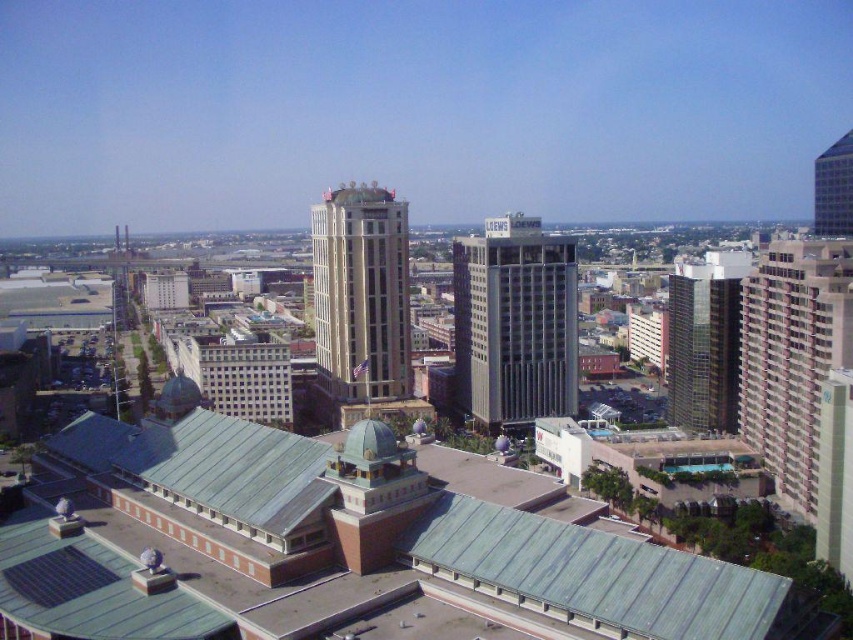
Is gray/concrete skyscraper at center thinner than glassy reflective skyscraper at upper right?

Yes.

Between gray/concrete skyscraper at center and glassy reflective skyscraper at upper right, which one has less height?

gray/concrete skyscraper at center is shorter.

Is point (498, 320) behind point (851, 132)?

No, (498, 320) is in front of (851, 132).

At what (x,y) coordinates should I click in order to perform the action: click on gray/concrete skyscraper at center. Please return your answer as a coordinate pair (x, y). This screenshot has width=853, height=640. Looking at the image, I should click on (515, 321).

Can you confirm if maroon brick building at right is positioned above beige stone tower at center?

Yes, maroon brick building at right is above beige stone tower at center.

Identify the location of maroon brick building at right. The width and height of the screenshot is (853, 640). (792, 355).

Find the location of a particular element. maroon brick building at right is located at coordinates (792, 355).

Which is more to the left, maroon brick building at right or green glass building at center-right?

Positioned to the left is green glass building at center-right.

Is maroon brick building at right smaller than green glass building at center-right?

No.

Which is in front, point (753, 304) or point (715, 333)?

Point (753, 304)

Locate an element on the screen. maroon brick building at right is located at coordinates (792, 355).